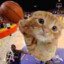
Locate an element on the screen. This screenshot has height=64, width=64. officials table is located at coordinates (7, 32).